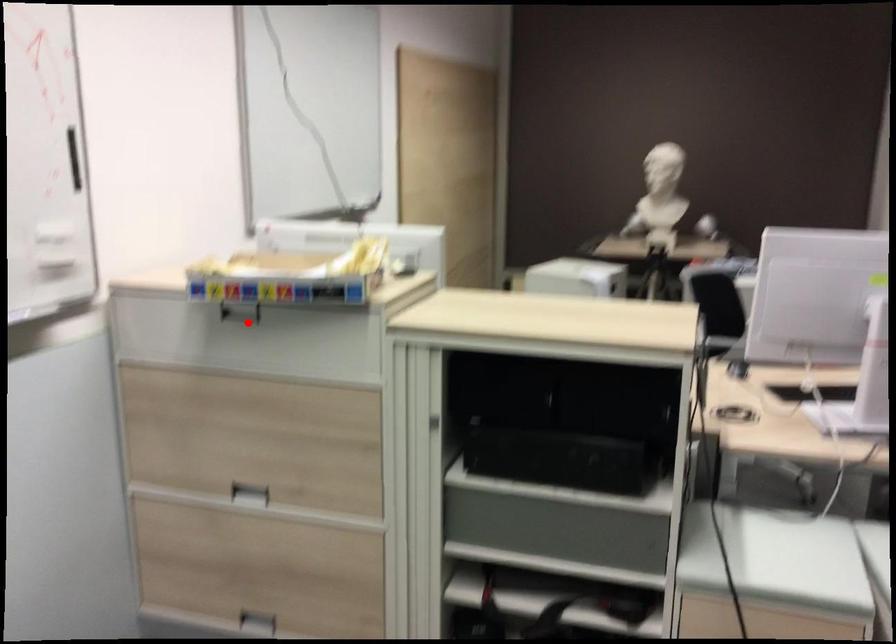
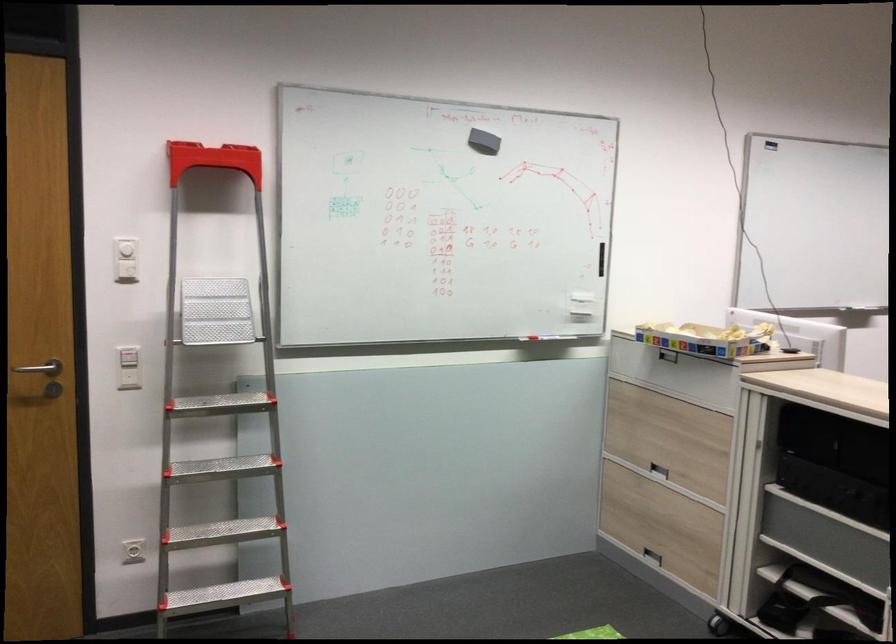
Find the pixel in the second image that matches the highlighted location in the first image.

(668, 355)